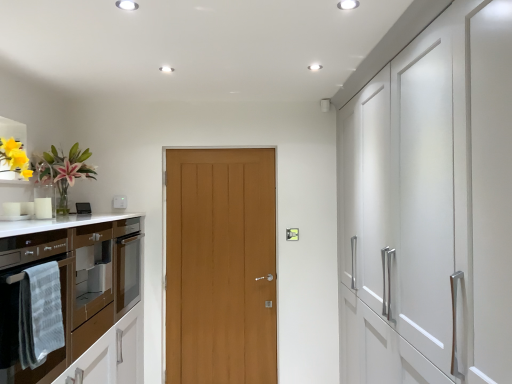
Question: Is gray textured towel at left oriented towards brown glossy oven at left?

Choices:
 (A) no
 (B) yes

Answer: (B)

Question: From the image's perspective, would you say gray textured towel at left is shown under brown glossy oven at left?

Choices:
 (A) no
 (B) yes

Answer: (A)

Question: From a real-world perspective, is gray textured towel at left physically below brown glossy oven at left?

Choices:
 (A) yes
 (B) no

Answer: (B)

Question: Considering the relative positions of gray textured towel at left and brown glossy oven at left in the image provided, is gray textured towel at left to the right of brown glossy oven at left from the viewer's perspective?

Choices:
 (A) yes
 (B) no

Answer: (A)

Question: Considering the relative sizes of gray textured towel at left and brown glossy oven at left in the image provided, is gray textured towel at left smaller than brown glossy oven at left?

Choices:
 (A) yes
 (B) no

Answer: (A)

Question: Is light brown wood door at center, which is counted as the first door, starting from the back, situated inside gray textured towel at left or outside?

Choices:
 (A) outside
 (B) inside

Answer: (A)

Question: From a real-world perspective, is light brown wood door at center, which is counted as the first door, starting from the back, positioned above or below gray textured towel at left?

Choices:
 (A) above
 (B) below

Answer: (B)

Question: In the image, is light brown wood door at center, acting as the second door starting from the front, positioned in front of or behind gray textured towel at left?

Choices:
 (A) behind
 (B) front

Answer: (A)

Question: Would you say light brown wood door at center, which is counted as the first door, starting from the back, is to the left or to the right of gray textured towel at left in the picture?

Choices:
 (A) left
 (B) right

Answer: (B)

Question: Visually, is brown glossy oven at left positioned to the left or to the right of gray textured towel at left?

Choices:
 (A) right
 (B) left

Answer: (B)

Question: From the image's perspective, is brown glossy oven at left located above or below gray textured towel at left?

Choices:
 (A) above
 (B) below

Answer: (B)

Question: Choose the correct answer: Is brown glossy oven at left inside gray textured towel at left or outside it?

Choices:
 (A) outside
 (B) inside

Answer: (A)

Question: Considering their positions, is brown glossy oven at left located in front of or behind gray textured towel at left?

Choices:
 (A) behind
 (B) front

Answer: (B)

Question: From a real-world perspective, is gray textured towel at left above or below light brown wood door at center, acting as the second door starting from the front?

Choices:
 (A) below
 (B) above

Answer: (B)

Question: Is gray textured towel at left to the left or to the right of light brown wood door at center, which is counted as the first door, starting from the back, in the image?

Choices:
 (A) right
 (B) left

Answer: (B)